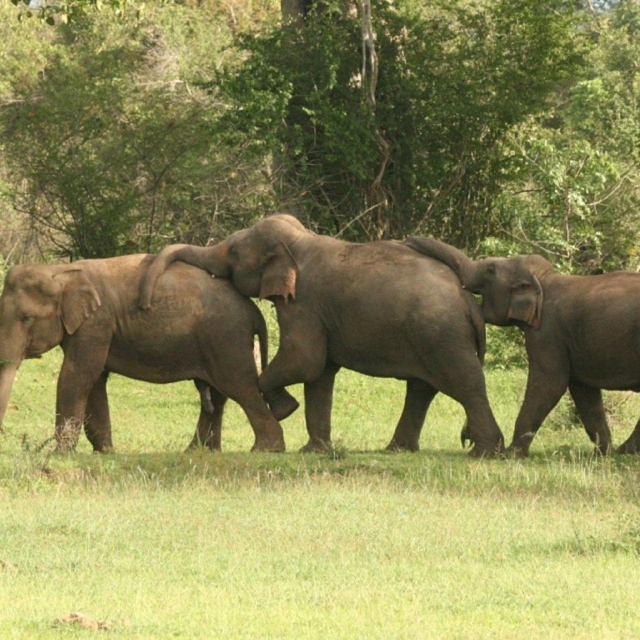
Question: Does gray matte elephant legs at center appear on the right side of gray matte elephant at center?

Choices:
 (A) no
 (B) yes

Answer: (B)

Question: Among these points, which one is nearest to the camera?

Choices:
 (A) (540, 344)
 (B) (234, 515)
 (C) (618, 141)
 (D) (116, 292)

Answer: (B)

Question: Can you confirm if gray textured baby elephant at center is smaller than gray textured elephant at center?

Choices:
 (A) yes
 (B) no

Answer: (B)

Question: Which object is farther from the camera taking this photo?

Choices:
 (A) gray matte elephant legs at center
 (B) gray matte elephant at center
 (C) gray textured elephant at center
 (D) green leafy tree at upper center

Answer: (D)

Question: Which object appears farthest from the camera in this image?

Choices:
 (A) gray textured baby elephant at center
 (B) gray matte elephant legs at center

Answer: (A)

Question: Does green leafy tree at upper center have a smaller size compared to gray textured baby elephant at center?

Choices:
 (A) no
 (B) yes

Answer: (A)